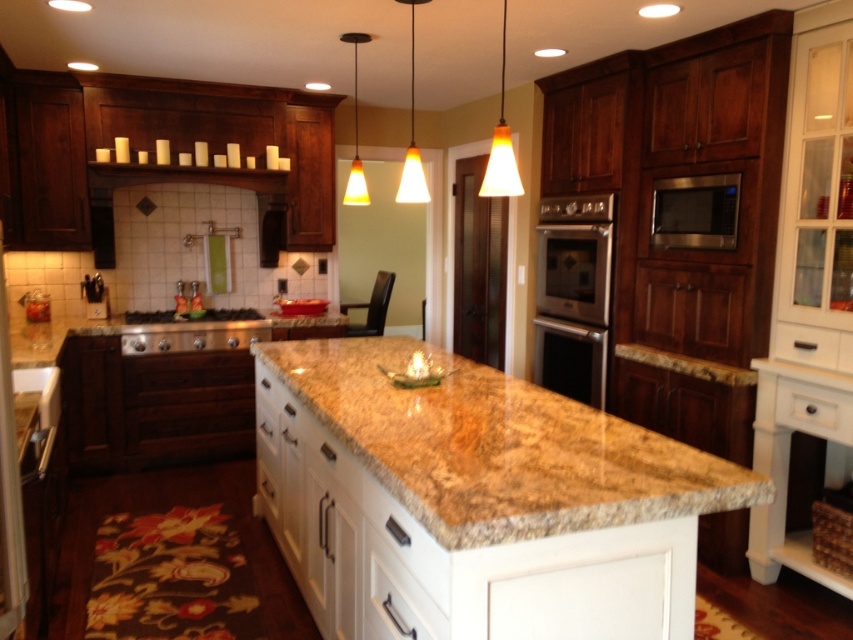
Who is more distant from viewer, [387,419] or [352,192]?

Positioned behind is point [352,192].

Which is behind, point (560, 524) or point (352, 173)?

Point (352, 173)

This screenshot has width=853, height=640. I want to click on brown granite countertop at center, so click(498, 445).

Is matte glass pendant light at center to the right of orange glass pendant light at center from the viewer's perspective?

Yes, matte glass pendant light at center is to the right of orange glass pendant light at center.

Can you confirm if matte glass pendant light at center is positioned above orange glass pendant light at center?

No, matte glass pendant light at center is not above orange glass pendant light at center.

Identify the location of matte glass pendant light at center. (412, 138).

At what (x,y) coordinates should I click in order to perform the action: click on matte glass pendant light at center. Please return your answer as a coordinate pair (x, y). The height and width of the screenshot is (640, 853). Looking at the image, I should click on (412, 138).

Does brown granite countertop at center have a larger size compared to matte glass pendant light at center?

Yes.

Which is in front, point (409, 448) or point (410, 157)?

Point (409, 448)

Is point (480, 465) more distant than point (405, 193)?

No, it is not.

Identify the location of brown granite countertop at center. (498, 445).